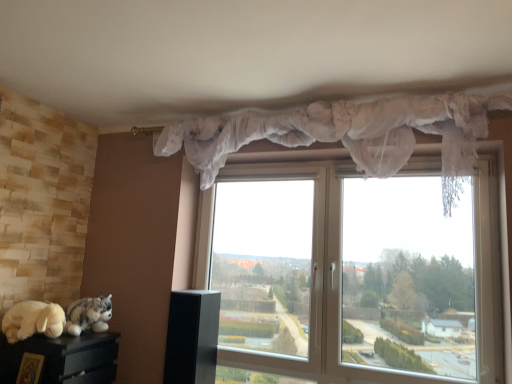
Question: Is transparent plastic window at center inside the boundaries of white lace curtain at upper center, or outside?

Choices:
 (A) inside
 (B) outside

Answer: (B)

Question: Is transparent plastic window at center in front of or behind white lace curtain at upper center in the image?

Choices:
 (A) behind
 (B) front

Answer: (A)

Question: Which object is the closest to the white lace curtain at upper center?

Choices:
 (A) transparent plastic window at center
 (B) wooden picture frame at lower left
 (C) white plush toy at lower left
 (D) fluffy gray plush at lower left

Answer: (A)

Question: Which of these objects is positioned closest to the transparent plastic window at center?

Choices:
 (A) fluffy gray plush at lower left
 (B) white plush toy at lower left
 (C) white lace curtain at upper center
 (D) wooden picture frame at lower left

Answer: (C)